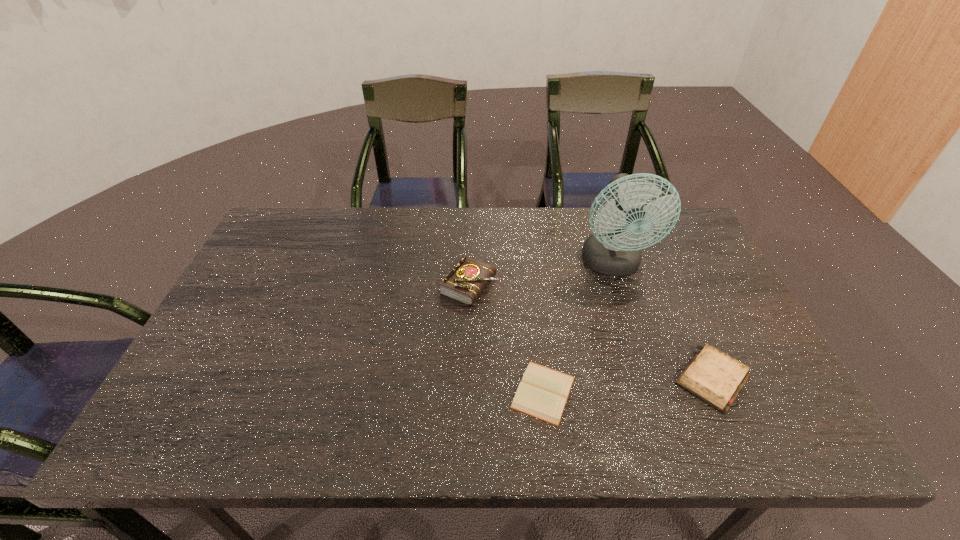
This screenshot has height=540, width=960. Find the location of `the tallest object`. the tallest object is located at coordinates (613, 249).

The image size is (960, 540). In order to click on the leftmost object in this screenshot , I will do `click(465, 282)`.

Locate an element on the screen. The image size is (960, 540). the farthest diary is located at coordinates (465, 282).

This screenshot has width=960, height=540. I want to click on the second shortest object, so click(x=714, y=377).

This screenshot has height=540, width=960. Identify the location of the second tallest diary. (714, 377).

Locate an element on the screen. Image resolution: width=960 pixels, height=540 pixels. the shortest diary is located at coordinates (543, 392).

You are a GUI agent. You are given a task and a screenshot of the screen. Output one action in this format:
    pyautogui.click(x=<x>, y=<y>)
    Task: Click on the third object from right to left
    Image resolution: width=960 pixels, height=540 pixels.
    Given the screenshot: What is the action you would take?
    pyautogui.click(x=543, y=392)

Find the location of `free space located 0.390m in front of the fan where the airflow is directed`. free space located 0.390m in front of the fan where the airflow is directed is located at coordinates (662, 417).

I want to click on vacant area located on the left of the leftmost diary, so click(392, 285).

I want to click on vacant space located on the back of the second tallest diary, so click(669, 284).